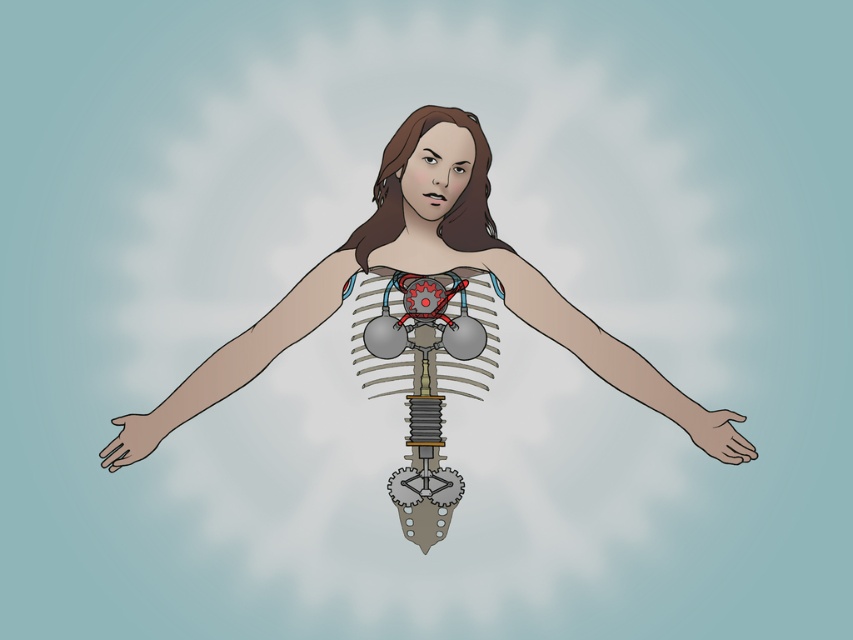
Question: Considering the relative positions of metallic gear at center and matte gray arm at center in the image provided, where is metallic gear at center located with respect to matte gray arm at center?

Choices:
 (A) left
 (B) right

Answer: (A)

Question: Which of the following is the closest to the observer?

Choices:
 (A) matte gray hand at lower left
 (B) smooth skin arm at left

Answer: (B)

Question: Which object is positioned closest to the matte brown hand at lower right?

Choices:
 (A) smooth skin arm at left
 (B) metallic mechanical girl at center
 (C) metallic gear at center
 (D) matte gray arm at center

Answer: (D)

Question: Is matte gray arm at center to the right of matte brown hand at lower right from the viewer's perspective?

Choices:
 (A) yes
 (B) no

Answer: (B)

Question: Can you confirm if metallic mechanical girl at center is bigger than matte gray arm at center?

Choices:
 (A) no
 (B) yes

Answer: (B)

Question: Among these points, which one is farthest from the camera?

Choices:
 (A) (140, 435)
 (B) (738, 445)

Answer: (A)